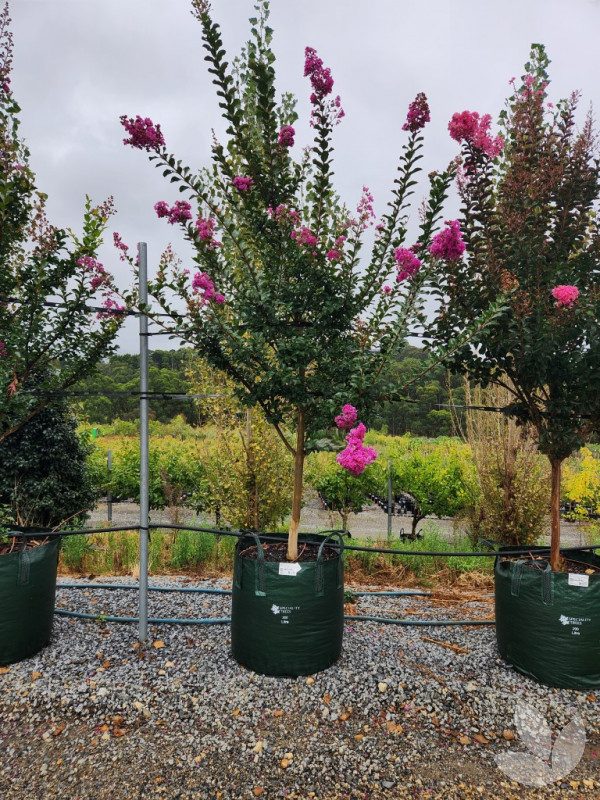
The image size is (600, 800). Find the location of `support pole`. support pole is located at coordinates (144, 578).